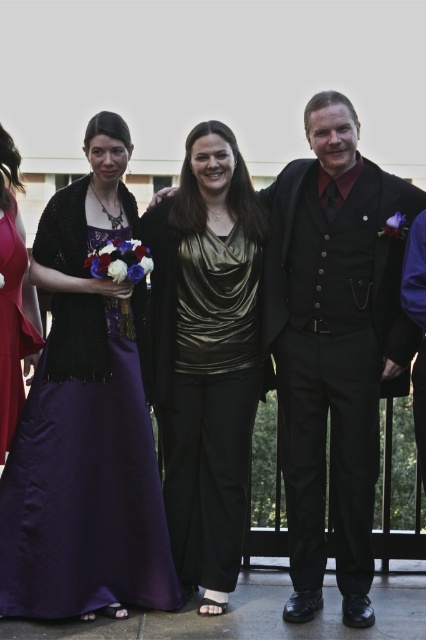
Between point (192, 444) and point (34, 346), which one is positioned behind?

Point (192, 444)

Is shiny gold blouse at center closer to the viewer compared to matte purple dress at left?

Yes, shiny gold blouse at center is closer to the viewer.

Is point (250, 211) farther from viewer compared to point (11, 305)?

Yes.

Locate an element on the screen. shiny gold blouse at center is located at coordinates (207, 355).

Which is more to the right, satin purple dress at left or shiny gold blouse at center?

From the viewer's perspective, shiny gold blouse at center appears more on the right side.

Is point (94, 385) more distant than point (204, 298)?

No, it is in front of (204, 298).

Where is `satin purple dress at left`? This screenshot has width=426, height=640. satin purple dress at left is located at coordinates (86, 420).

Locate an element on the screen. The height and width of the screenshot is (640, 426). satin purple dress at left is located at coordinates (86, 420).

Does shiny black vest at center come behind shiny gold blouse at center?

No, shiny black vest at center is closer to the viewer.

Which is in front, point (322, 499) or point (215, 310)?

Point (322, 499)

The image size is (426, 640). Find the location of `shiny black vest at center`. shiny black vest at center is located at coordinates (334, 344).